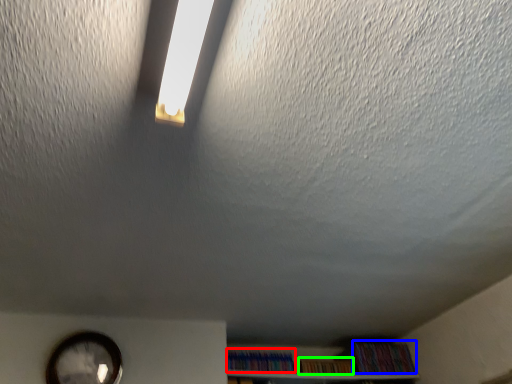
Question: Which is nearer to the book (highlighted by a red box)? book (highlighted by a blue box) or book (highlighted by a green box).

Choices:
 (A) book
 (B) book

Answer: (B)